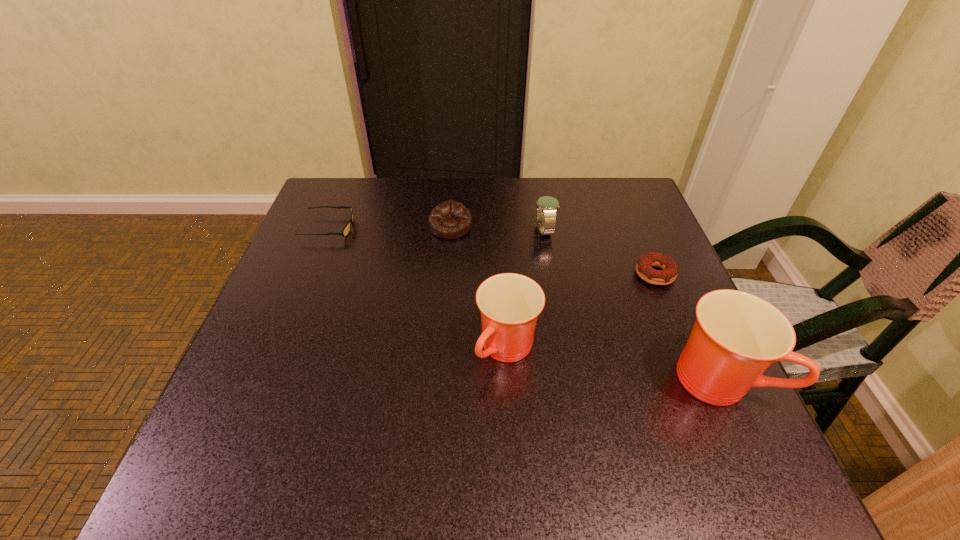
What are the coordinates of `vacant space at the near left corner` in the screenshot? It's located at (277, 426).

Image resolution: width=960 pixels, height=540 pixels. In the image, there is a desktop. In order to click on vacant space at the far right corner in this screenshot , I will do `click(602, 195)`.

The image size is (960, 540). What are the coordinates of `free space between the doughnut and the leftmost object` in the screenshot? It's located at (492, 251).

Where is `free space between the doughnut and the watch`? The width and height of the screenshot is (960, 540). free space between the doughnut and the watch is located at coordinates (600, 252).

Identify the location of free spot between the watch and the beanbag. The image size is (960, 540). (497, 228).

Identify the location of vacant region between the doughnut and the fourth object from left to right. Image resolution: width=960 pixels, height=540 pixels. (600, 252).

The width and height of the screenshot is (960, 540). In order to click on unoccupied position between the fifth object from right to left and the third nearest object in this screenshot , I will do `click(553, 251)`.

Where is `vacant space that is in between the doughnut and the beanbag`? The height and width of the screenshot is (540, 960). vacant space that is in between the doughnut and the beanbag is located at coordinates (553, 251).

Locate an element on the screen. This screenshot has width=960, height=540. object that stands as the second closest to the right cup is located at coordinates (510, 303).

Select which object is the fourth closest to the shorter cup. Please provide its 2D coordinates. Your answer should be formatted as a tuple, i.e. [(x, y)], where the tuple contains the x and y coordinates of a point satisfying the conditions above.

[(450, 219)]